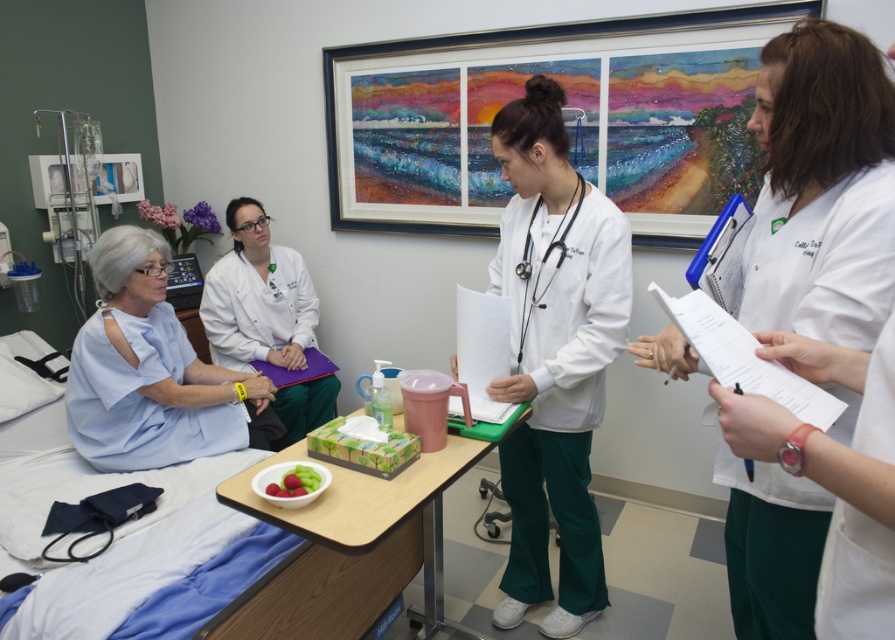
You are a nurse in a hospital room. You need to place a medical chart on the light blue fabric at left and the smooth plastic bowl at center. Which surface can you place the chart on without it falling off?

The light blue fabric at left is 3.35 feet from the smooth plastic bowl at center. Since the light blue fabric is fabric, it is not a flat surface, so the medical chart would not stay upright. The smooth plastic bowl at center is a stable surface for placing the chart.

You are a nurse in this hospital room. You need to place a medical chart on the light blue fabric at left and the smooth plastic bowl at center. Which surface can accommodate the chart without it hanging off the edge?

The light blue fabric at left is wider than the smooth plastic bowl at center, so the medical chart should be placed on the light blue fabric at left to ensure it fits properly without hanging off the edge.

Where is the white matte lab coat at center located in the image?

The white matte lab coat at center is located at point (257, 296) in the image.